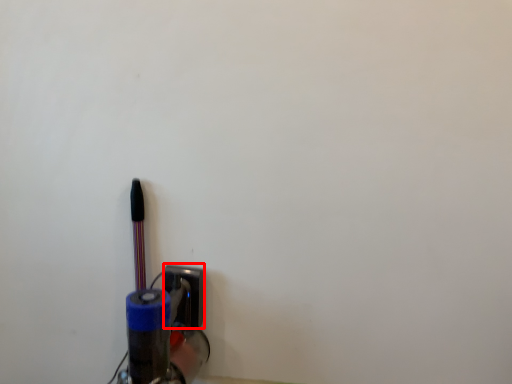
Question: From the image, what is the correct spatial relationship of socket (annotated by the red box) in relation to penguin?

Choices:
 (A) right
 (B) left

Answer: (A)